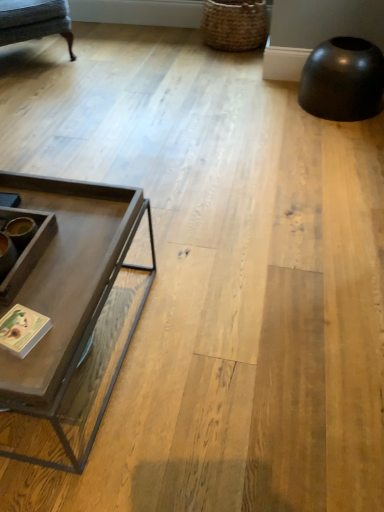
Question: Does woven brown basket at upper right have a smaller size compared to textured gray fabric swivel chair at upper left?

Choices:
 (A) no
 (B) yes

Answer: (B)

Question: Is woven brown basket at upper right looking in the opposite direction of textured gray fabric swivel chair at upper left?

Choices:
 (A) no
 (B) yes

Answer: (A)

Question: Does woven brown basket at upper right appear on the left side of textured gray fabric swivel chair at upper left?

Choices:
 (A) yes
 (B) no

Answer: (B)

Question: Does woven brown basket at upper right lie behind textured gray fabric swivel chair at upper left?

Choices:
 (A) no
 (B) yes

Answer: (B)

Question: Does woven brown basket at upper right appear on the right side of textured gray fabric swivel chair at upper left?

Choices:
 (A) yes
 (B) no

Answer: (A)

Question: Is textured gray fabric swivel chair at upper left surrounded by woven brown basket at upper right?

Choices:
 (A) yes
 (B) no

Answer: (B)

Question: Is matte gray coffee table at left located outside woven brown basket at upper right?

Choices:
 (A) no
 (B) yes

Answer: (B)

Question: From a real-world perspective, is matte gray coffee table at left physically above woven brown basket at upper right?

Choices:
 (A) no
 (B) yes

Answer: (A)

Question: From the image's perspective, is matte gray coffee table at left located above woven brown basket at upper right?

Choices:
 (A) yes
 (B) no

Answer: (B)

Question: Is woven brown basket at upper right at the back of matte gray coffee table at left?

Choices:
 (A) no
 (B) yes

Answer: (A)

Question: Does matte gray coffee table at left have a smaller size compared to woven brown basket at upper right?

Choices:
 (A) yes
 (B) no

Answer: (B)

Question: Is matte gray coffee table at left positioned far away from woven brown basket at upper right?

Choices:
 (A) no
 (B) yes

Answer: (B)

Question: Is textured gray fabric swivel chair at upper left next to woven brown basket at upper right and touching it?

Choices:
 (A) yes
 (B) no

Answer: (B)